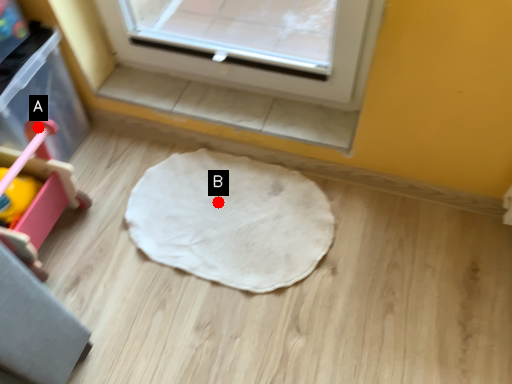
Question: Two points are circled on the image, labeled by A and B beside each circle. Which point is closer to the camera taking this photo?

Choices:
 (A) A is closer
 (B) B is closer

Answer: (A)